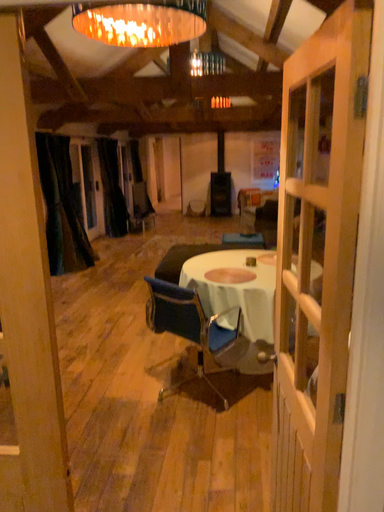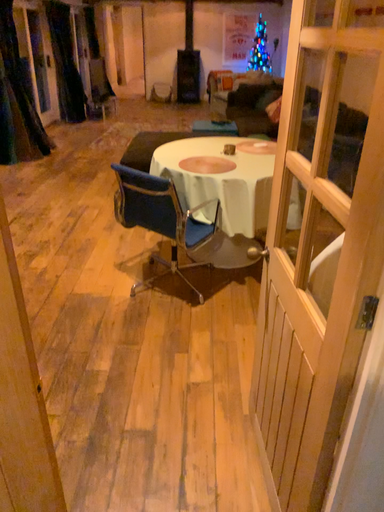
Question: How did the camera likely rotate when shooting the video?

Choices:
 (A) rotated upward
 (B) rotated downward

Answer: (B)